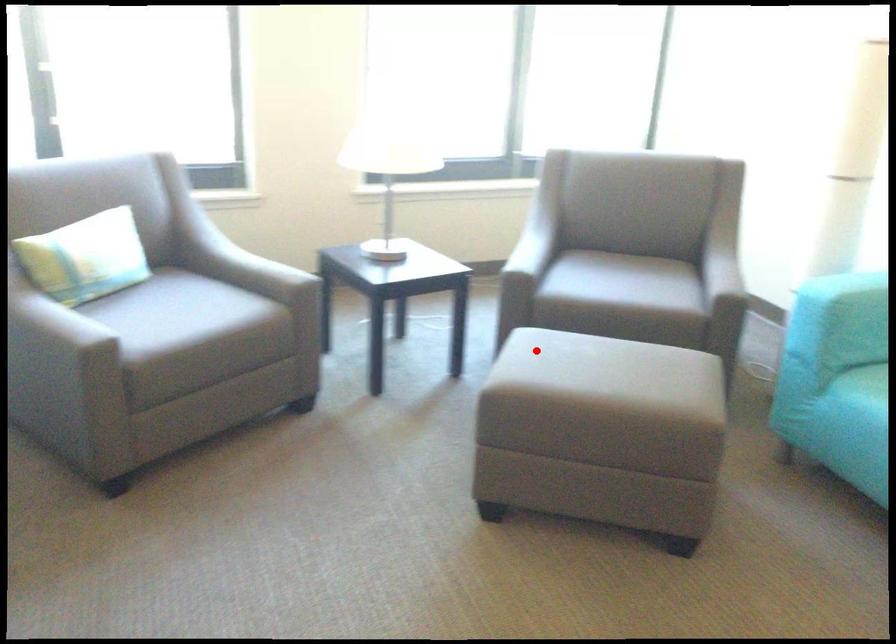
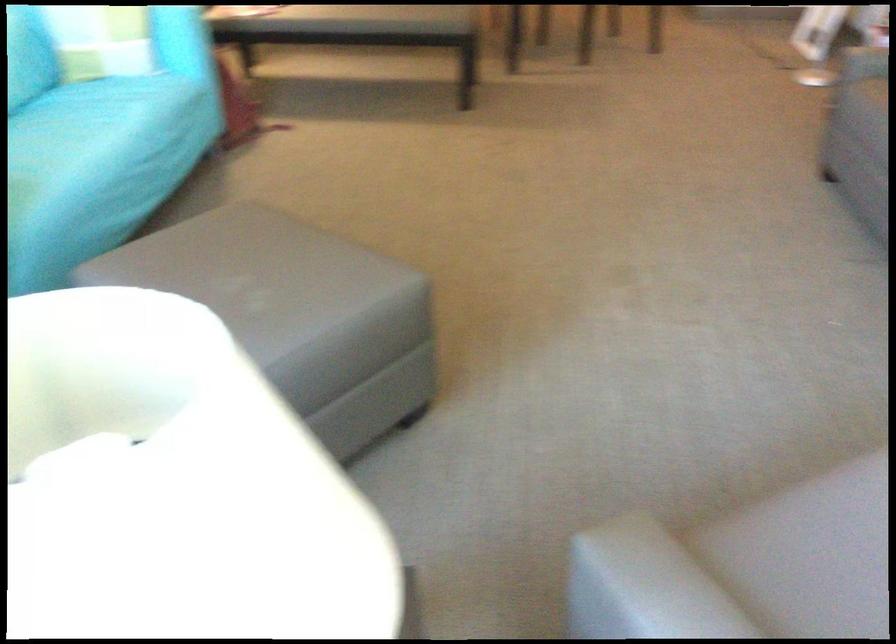
Question: A red point is marked in image1. In image2, is the corresponding 3D point closer to the camera or farther? Reply with the corresponding letter.

Choices:
 (A) The corresponding 3D point is closer.
 (B) The corresponding 3D point is farther.

Answer: (A)